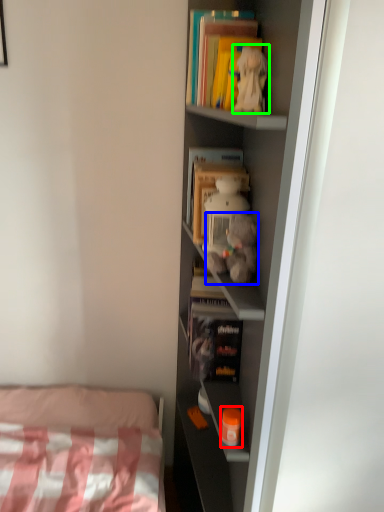
Question: Which is nearer to the toy (highlighted by a red box)? toy (highlighted by a blue box) or toy (highlighted by a green box).

Choices:
 (A) toy
 (B) toy

Answer: (A)